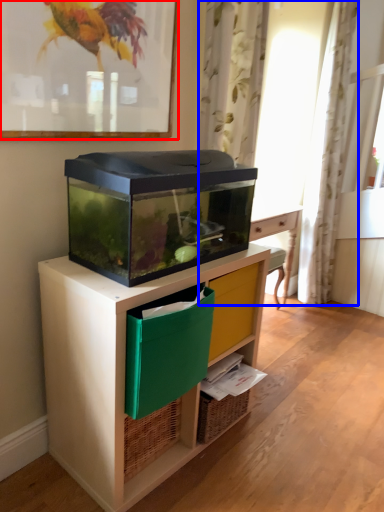
Question: Which of the following is the farthest to the observer, picture frame (highlighted by a red box) or curtain (highlighted by a blue box)?

Choices:
 (A) picture frame
 (B) curtain

Answer: (B)